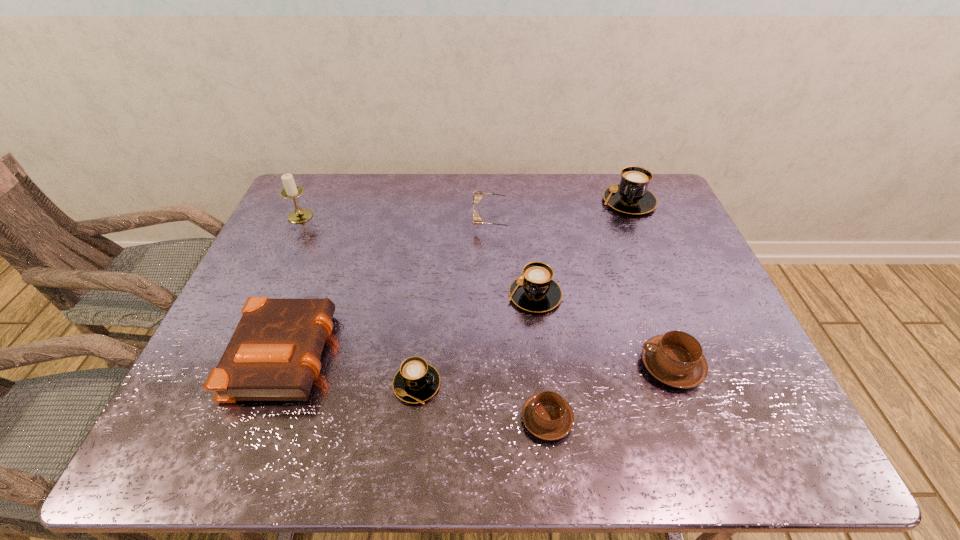
The height and width of the screenshot is (540, 960). I want to click on candle holder, so click(291, 190).

Locate an element on the screen. white candle holder is located at coordinates (291, 190).

Locate an element on the screen. This screenshot has width=960, height=540. the tallest cappuccino is located at coordinates (631, 196).

Where is `the farthest cappuccino`? Image resolution: width=960 pixels, height=540 pixels. the farthest cappuccino is located at coordinates (631, 196).

The height and width of the screenshot is (540, 960). In order to click on the second farthest black cappuccino in this screenshot , I will do `click(535, 291)`.

At what (x,y) coordinates should I click in order to perform the action: click on the second black cappuccino from right to left. Please return your answer as a coordinate pair (x, y). The image size is (960, 540). Looking at the image, I should click on (535, 291).

Where is `sunglasses`? sunglasses is located at coordinates (477, 220).

Locate an element on the screen. This screenshot has height=540, width=960. Bible is located at coordinates (274, 354).

The image size is (960, 540). Identify the location of the bigger brown cappuccino. (675, 358).

The height and width of the screenshot is (540, 960). What are the coordinates of `the farther brown cappuccino` in the screenshot? It's located at (675, 358).